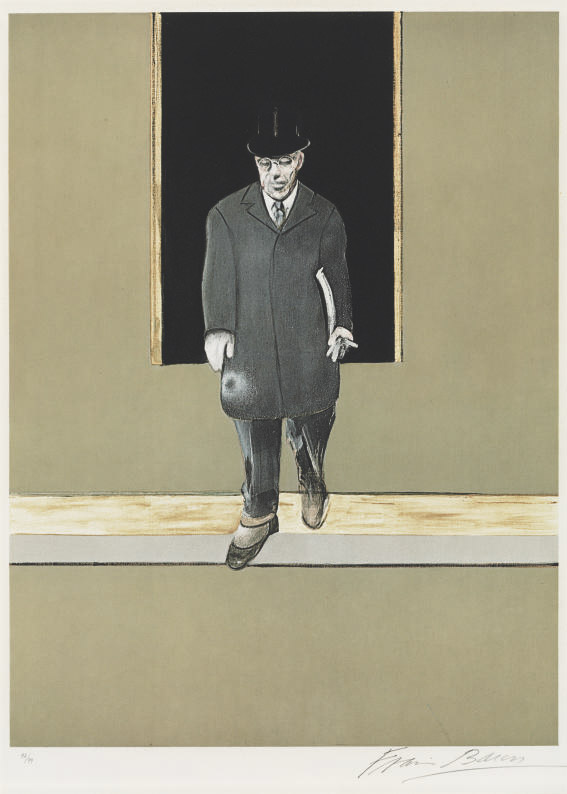
Locate an element on the screen. beam is located at coordinates (171, 545).